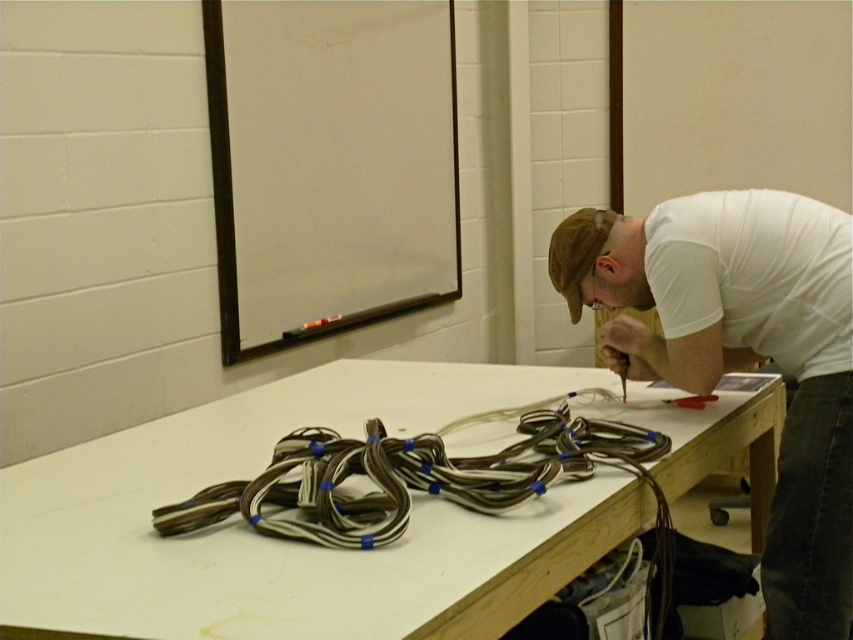
You are organizing a workspace. You have a white matte table at center and a white cotton shirt at upper right. Which object has a greater width?

The white matte table at center has a greater width than the white cotton shirt at upper right.

You are trying to determine if the white cotton shirt at upper right can be placed over the brown rubberized cables at center without covering them completely. Based on their widths, can the shirt be positioned in such a way?

The white cotton shirt at upper right is narrower than the brown rubberized cables at center. Therefore, placing the shirt over the cables would leave parts of the cables visible since the shirt is narrower.